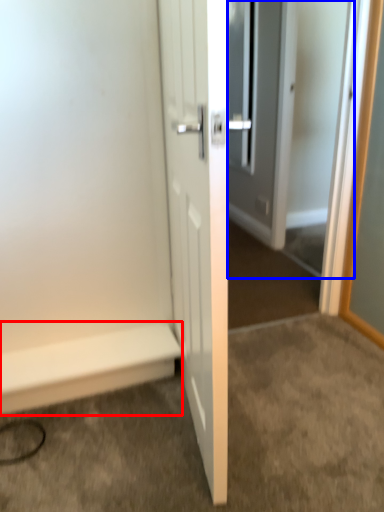
Question: Which object appears closest to the camera in this image, stairwell (highlighted by a red box) or screen door (highlighted by a blue box)?

Choices:
 (A) stairwell
 (B) screen door

Answer: (B)